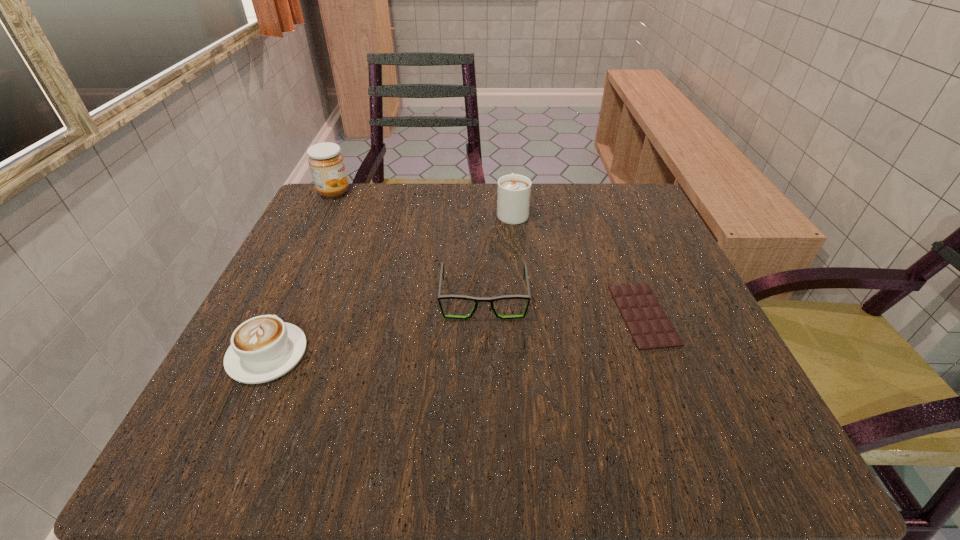
Find the location of a particular element. the tallest object is located at coordinates (326, 163).

What are the coordinates of `the right cappuccino` in the screenshot? It's located at (513, 196).

The height and width of the screenshot is (540, 960). In order to click on the taller cappuccino in this screenshot , I will do `click(513, 196)`.

At what (x,y) coordinates should I click in order to perform the action: click on spectacles. Please return your answer as a coordinate pair (x, y). This screenshot has width=960, height=540. Looking at the image, I should click on (475, 299).

At what (x,y) coordinates should I click in order to perform the action: click on the nearer cappuccino. Please return your answer as a coordinate pair (x, y). This screenshot has width=960, height=540. Looking at the image, I should click on (263, 348).

In order to click on the left cappuccino in this screenshot , I will do `click(263, 348)`.

Image resolution: width=960 pixels, height=540 pixels. Identify the location of the rightmost object. (649, 326).

The height and width of the screenshot is (540, 960). I want to click on the shortest object, so click(x=649, y=326).

At what (x,y) coordinates should I click in order to perform the action: click on vacant area situated 0.090m on the front label of the tallest object. Please return your answer as a coordinate pair (x, y). Looking at the image, I should click on (388, 192).

Locate an element on the screen. The image size is (960, 540). vacant region located 0.140m on the lens of the spectacles is located at coordinates point(485,390).